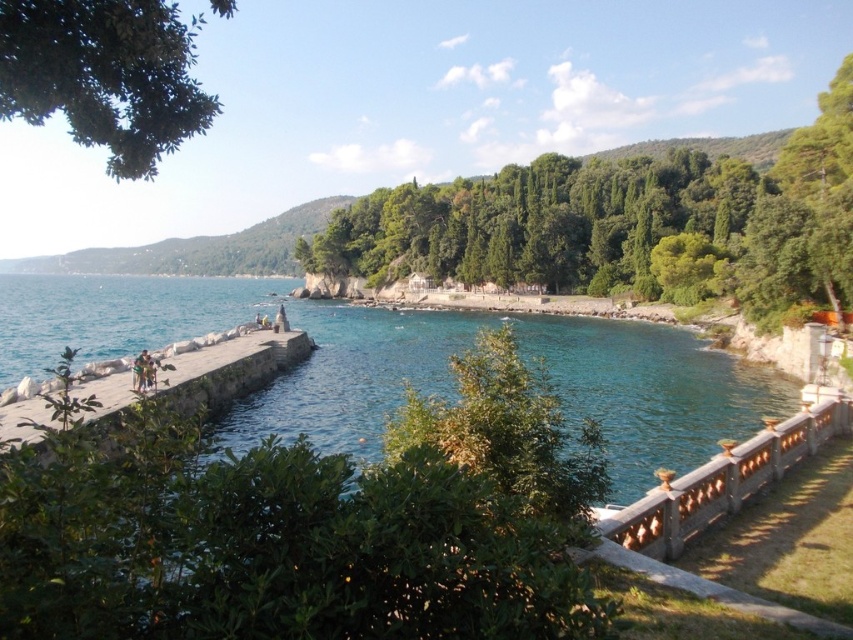
You are standing at the point marked by the coordinates point (624,225) and want to walk towards the stone railing. Which direction should you head to reach the stone railing that is partially hidden by the greenery?

The green leafy tree at center is represented by point (624,225), so you should head towards the edge of the grassy area where the stone railing is located, which is obscured by the greenery in the foreground.

You are a photographer standing at the camera position. You want to take a photo of the green leafy tree at upper left. Is the distance between you and the tree sufficient to capture the entire tree in your shot if your camera has a 50mm lens?

The distance between you and the green leafy tree at upper left is 7.87 meters. With a 50mm lens, this distance should allow you to capture the entire tree in your shot, assuming the tree is within the field of view of the lens.

You are a landscape architect designing a walking path between the green leafy tree at center and the green leafy tree at upper left. The path must be straight and 2 meters wide. Can you fit the path between them without it being too narrow?

The distance between the green leafy tree at center and the green leafy tree at upper left is 79.04 meters. Since the path only needs to be 2 meters wide, there is ample space to fit the path between them without any issues.